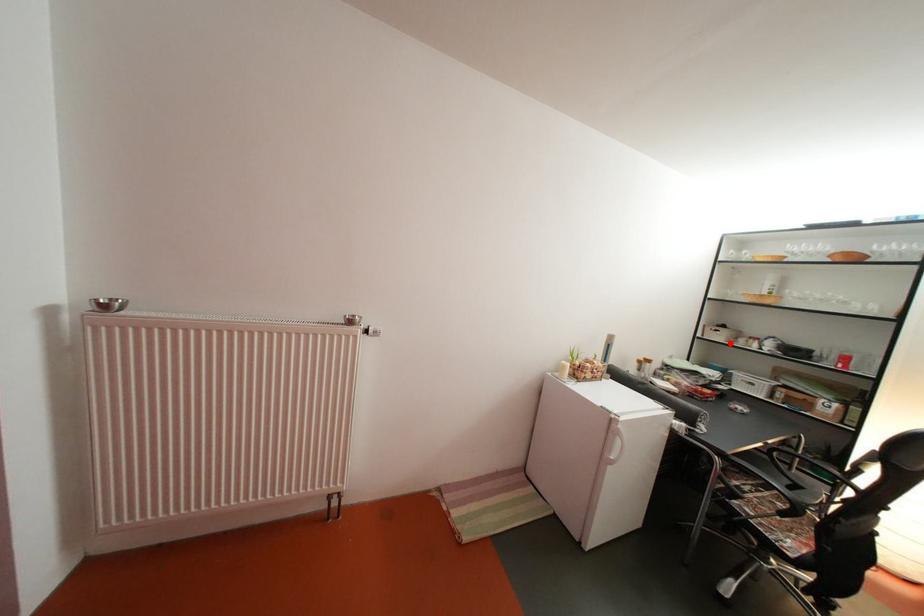
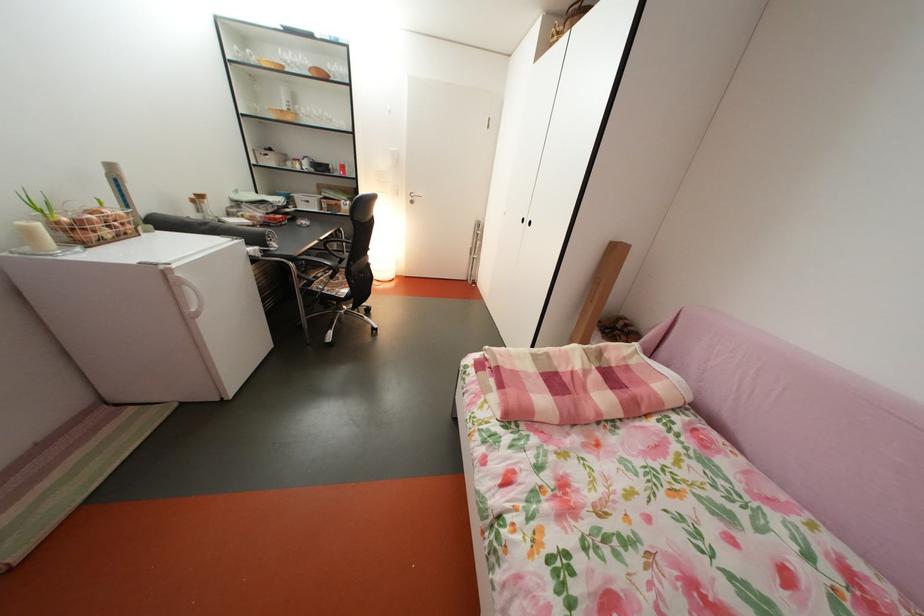
In the second image, find the point that corresponds to the highlighted location in the first image.

(283, 168)